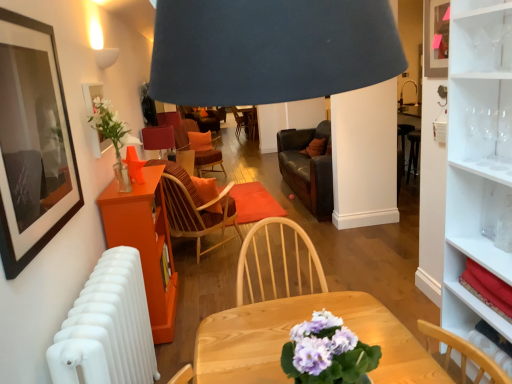
Question: Is white matte radiator at lower left shorter than white glossy cabinet at upper right?

Choices:
 (A) no
 (B) yes

Answer: (A)

Question: Does white matte radiator at lower left lie behind white glossy cabinet at upper right?

Choices:
 (A) yes
 (B) no

Answer: (B)

Question: From a real-world perspective, is white matte radiator at lower left on white glossy cabinet at upper right?

Choices:
 (A) yes
 (B) no

Answer: (B)

Question: Does white matte radiator at lower left have a greater height compared to white glossy cabinet at upper right?

Choices:
 (A) yes
 (B) no

Answer: (A)

Question: From the image's perspective, is white matte radiator at lower left below white glossy cabinet at upper right?

Choices:
 (A) yes
 (B) no

Answer: (A)

Question: From a real-world perspective, is clear glass vase at upper left positioned above or below clear glass wine glass at upper right, marked as the first wine glass in a left-to-right arrangement?

Choices:
 (A) below
 (B) above

Answer: (B)

Question: Considering the relative positions of clear glass vase at upper left and clear glass wine glass at upper right, which is counted as the 3th wine glass, starting from the right, in the image provided, is clear glass vase at upper left to the left or to the right of clear glass wine glass at upper right, which is counted as the 3th wine glass, starting from the right,?

Choices:
 (A) left
 (B) right

Answer: (A)

Question: Is clear glass vase at upper left inside or outside of clear glass wine glass at upper right, which is counted as the 3th wine glass, starting from the right?

Choices:
 (A) inside
 (B) outside

Answer: (B)

Question: Is clear glass vase at upper left wider or thinner than clear glass wine glass at upper right, which is counted as the 3th wine glass, starting from the right?

Choices:
 (A) thin
 (B) wide

Answer: (B)

Question: Visually, is clear glass vase at upper left positioned to the left or to the right of orange fabric chair at center, the 1th chair in the back-to-front sequence?

Choices:
 (A) right
 (B) left

Answer: (A)

Question: Is clear glass vase at upper left inside or outside of orange fabric chair at center, which appears as the 2th chair when viewed from the front?

Choices:
 (A) outside
 (B) inside

Answer: (A)

Question: From a real-world perspective, is clear glass vase at upper left physically located above or below orange fabric chair at center, the 1th chair in the back-to-front sequence?

Choices:
 (A) below
 (B) above

Answer: (B)

Question: Relative to orange fabric chair at center, which appears as the 2th chair when viewed from the front, is clear glass vase at upper left in front or behind?

Choices:
 (A) behind
 (B) front

Answer: (B)

Question: In terms of height, does white matte radiator at lower left look taller or shorter compared to matte red table lamp at center?

Choices:
 (A) short
 (B) tall

Answer: (B)

Question: Choose the correct answer: Is white matte radiator at lower left inside matte red table lamp at center or outside it?

Choices:
 (A) outside
 (B) inside

Answer: (A)